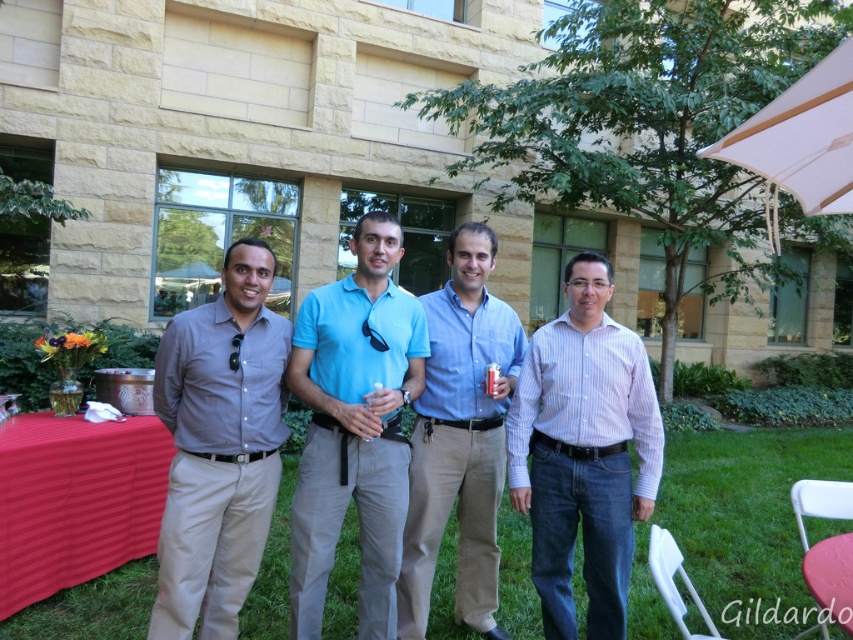
Which is more to the right, light blue polo shirt at center or black satin tie at center?

From the viewer's perspective, light blue polo shirt at center appears more on the right side.

Which of these two, light blue polo shirt at center or black satin tie at center, stands taller?

light blue polo shirt at center is taller.

Locate an element on the screen. light blue polo shirt at center is located at coordinates (354, 428).

Locate an element on the screen. light blue polo shirt at center is located at coordinates (354, 428).

In the scene shown: Is blue cotton shirt at center to the left of black satin tie at center from the viewer's perspective?

Incorrect, blue cotton shirt at center is not on the left side of black satin tie at center.

Is blue cotton shirt at center below black satin tie at center?

Correct, blue cotton shirt at center is located below black satin tie at center.

Between point (477, 499) and point (236, 355), which one is positioned behind?

The point (477, 499) is more distant.

I want to click on blue cotton shirt at center, so click(x=459, y=438).

Does blue cotton shirt at center appear under red fabric tablecloth at lower left?

No.

Which is more to the right, blue cotton shirt at center or red fabric tablecloth at lower left?

blue cotton shirt at center

Who is more forward, (469, 394) or (86, 481)?

Point (469, 394) is more forward.

Find the location of a particular element. Image resolution: width=853 pixels, height=640 pixels. blue cotton shirt at center is located at coordinates (459, 438).